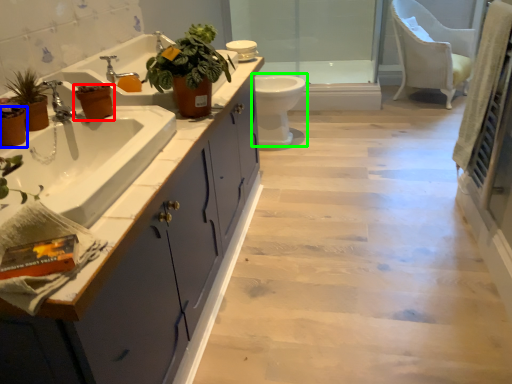
Question: Estimate the real-world distances between objects in this image. Which object is closer to flowerpot (highlighted by a red box), flowerpot (highlighted by a blue box) or toilet (highlighted by a green box)?

Choices:
 (A) flowerpot
 (B) toilet

Answer: (A)